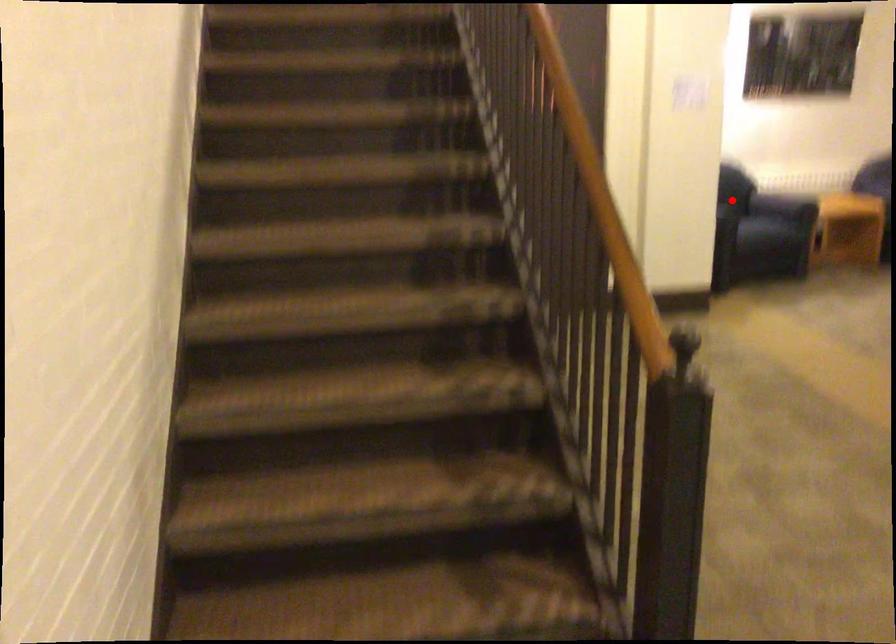
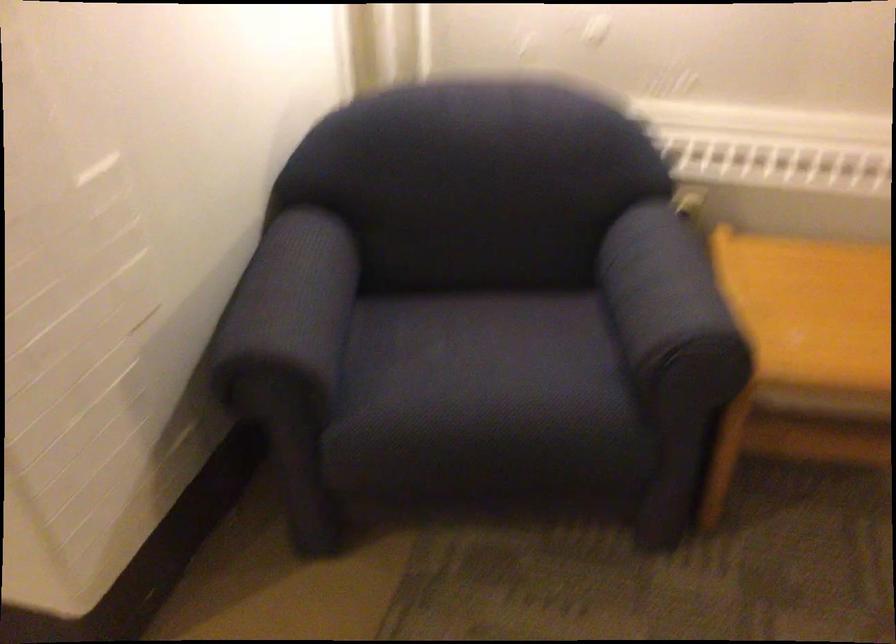
Question: I am providing you with two images of the same scene from different viewpoints. A red point is marked on the first image. Can you still see the location of the red point in image 2?

Choices:
 (A) Yes
 (B) No

Answer: (A)